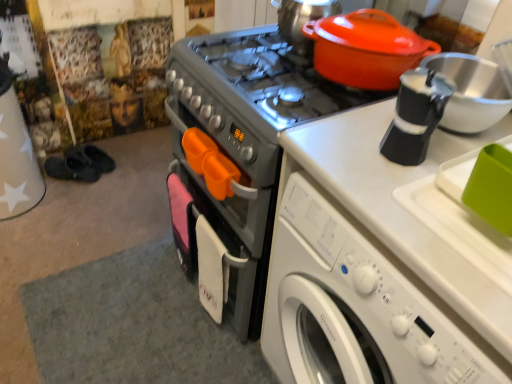
Question: Is matte orange tea pot at upper right to the right of metallic gray stove at center from the viewer's perspective?

Choices:
 (A) yes
 (B) no

Answer: (A)

Question: Is matte orange tea pot at upper right positioned in front of metallic gray stove at center?

Choices:
 (A) no
 (B) yes

Answer: (A)

Question: From a real-world perspective, is matte orange tea pot at upper right on metallic gray stove at center?

Choices:
 (A) no
 (B) yes

Answer: (B)

Question: From the image's perspective, does matte orange tea pot at upper right appear lower than metallic gray stove at center?

Choices:
 (A) no
 (B) yes

Answer: (A)

Question: Could you tell me if matte orange tea pot at upper right is turned towards metallic gray stove at center?

Choices:
 (A) no
 (B) yes

Answer: (A)

Question: From a real-world perspective, is matte orange tea pot at upper right below metallic gray stove at center?

Choices:
 (A) no
 (B) yes

Answer: (A)

Question: From the image's perspective, is metallic gray stove at center under matte orange pot at upper right?

Choices:
 (A) no
 (B) yes

Answer: (B)

Question: From a real-world perspective, is metallic gray stove at center on matte orange pot at upper right?

Choices:
 (A) no
 (B) yes

Answer: (A)

Question: Is metallic gray stove at center looking in the opposite direction of matte orange pot at upper right?

Choices:
 (A) no
 (B) yes

Answer: (A)

Question: Is metallic gray stove at center wider than matte orange pot at upper right?

Choices:
 (A) no
 (B) yes

Answer: (B)

Question: Does metallic gray stove at center have a greater height compared to matte orange pot at upper right?

Choices:
 (A) yes
 (B) no

Answer: (A)

Question: Does metallic gray stove at center have a lesser height compared to matte orange pot at upper right?

Choices:
 (A) no
 (B) yes

Answer: (A)

Question: Is matte orange tea pot at upper right oriented towards matte orange pot at upper right?

Choices:
 (A) no
 (B) yes

Answer: (A)